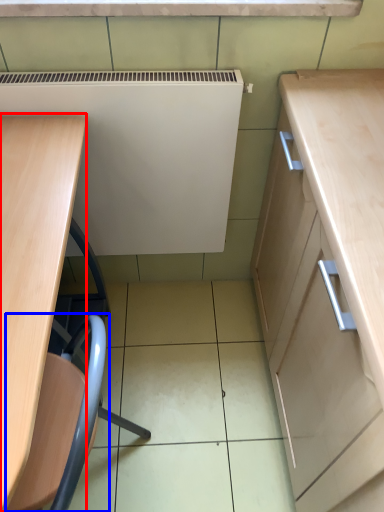
Question: Which of the following is the farthest to the observer, desk (highlighted by a red box) or swivel chair (highlighted by a blue box)?

Choices:
 (A) desk
 (B) swivel chair

Answer: (B)